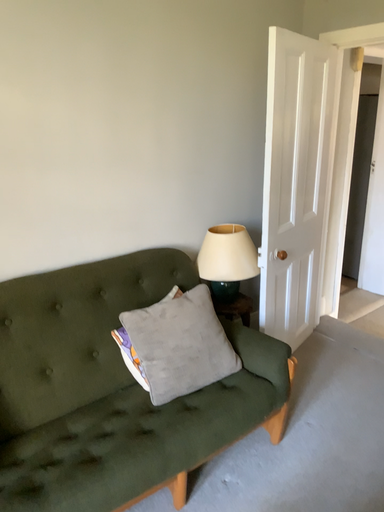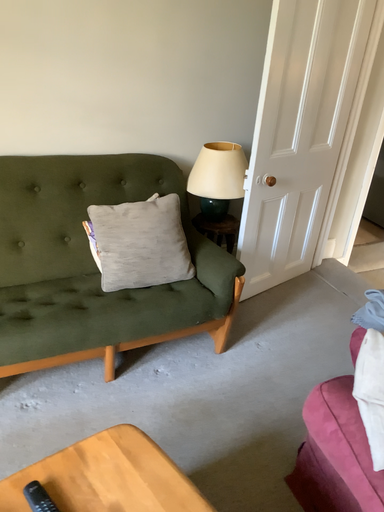
Question: How did the camera likely rotate when shooting the video?

Choices:
 (A) rotated upward
 (B) rotated downward

Answer: (B)